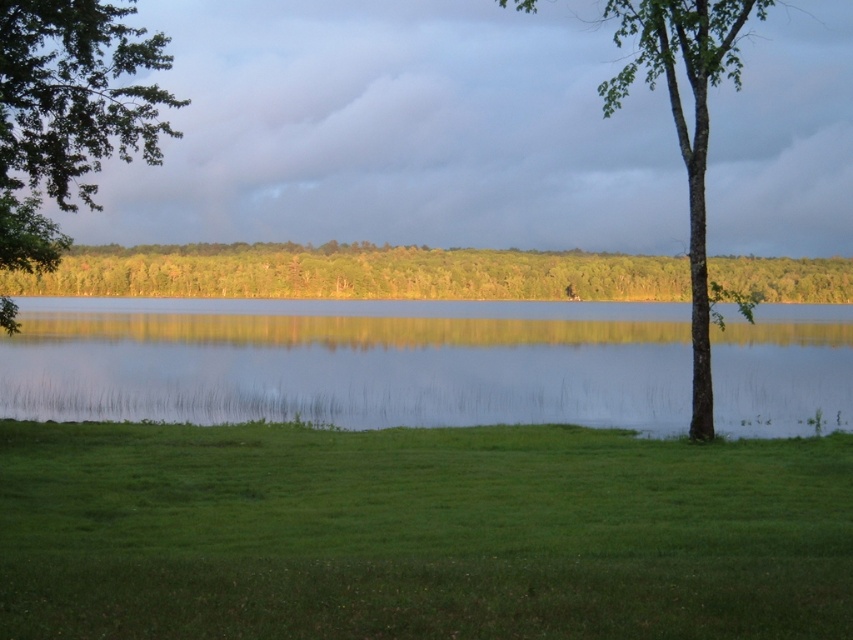
Between clear water at center and green leafy tree at upper left, which one appears on the right side from the viewer's perspective?

clear water at center is more to the right.

Between point (451, 336) and point (134, 122), which one is positioned in front?

Point (134, 122) is more forward.

Who is more forward, (102, 332) or (97, 90)?

Point (97, 90) is more forward.

You are a GUI agent. You are given a task and a screenshot of the screen. Output one action in this format:
    pyautogui.click(x=<x>, y=<y>)
    Task: Click on the clear water at center
    The height and width of the screenshot is (640, 853).
    Given the screenshot: What is the action you would take?
    pyautogui.click(x=349, y=362)

Is clear water at center thinner than green smooth bark tree at right?

No.

Is clear water at center taller than green smooth bark tree at right?

No, clear water at center is not taller than green smooth bark tree at right.

Measure the distance between clear water at center and camera.

They are 25.26 meters apart.

Image resolution: width=853 pixels, height=640 pixels. I want to click on clear water at center, so click(349, 362).

Is green leafy tree at upper left below green smooth bark tree at right?

Correct, green leafy tree at upper left is located below green smooth bark tree at right.

Is green leafy tree at upper left bigger than green smooth bark tree at right?

Yes.

Where is `green leafy tree at upper left`? This screenshot has width=853, height=640. green leafy tree at upper left is located at coordinates (68, 113).